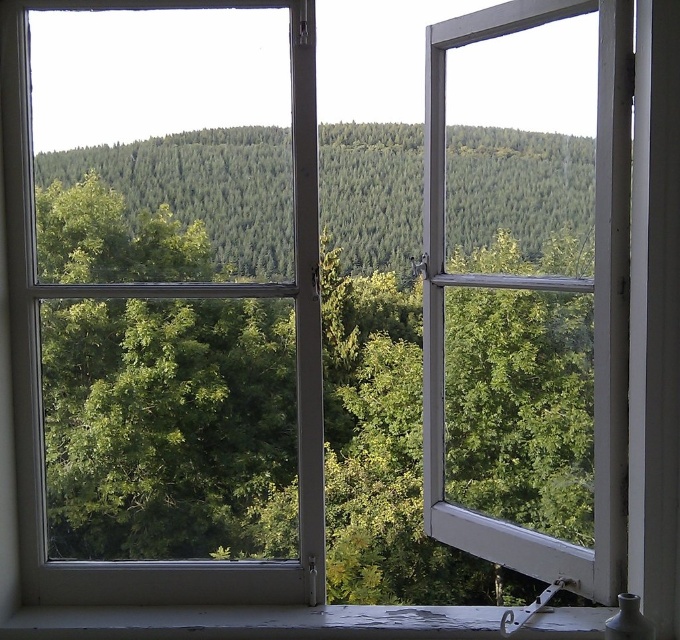
Question: Can you confirm if green forested hill at center is wider than white painted wood at lower center?

Choices:
 (A) yes
 (B) no

Answer: (B)

Question: Which point is farther from the camera taking this photo?

Choices:
 (A) (409, 625)
 (B) (403, 168)

Answer: (B)

Question: Among these objects, which one is nearest to the camera?

Choices:
 (A) green forested hill at center
 (B) white painted wood at lower center

Answer: (B)

Question: Is green forested hill at center thinner than white painted wood at lower center?

Choices:
 (A) yes
 (B) no

Answer: (A)

Question: Is green forested hill at center closer to the viewer compared to white painted wood at lower center?

Choices:
 (A) yes
 (B) no

Answer: (B)

Question: Which of the following is the farthest from the observer?

Choices:
 (A) (109, 627)
 (B) (452, 147)

Answer: (B)